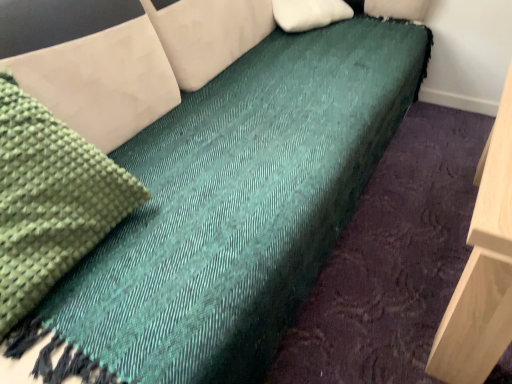
Question: Should I look upward or downward to see green knitted fabric at left?

Choices:
 (A) down
 (B) up

Answer: (B)

Question: Would you consider white soft pillow at upper center to be distant from green knitted fabric at left?

Choices:
 (A) no
 (B) yes

Answer: (B)

Question: Does white soft pillow at upper center have a lesser width compared to green knitted fabric at left?

Choices:
 (A) no
 (B) yes

Answer: (A)

Question: From a real-world perspective, does white soft pillow at upper center stand above green knitted fabric at left?

Choices:
 (A) yes
 (B) no

Answer: (B)

Question: Does white soft pillow at upper center appear on the right side of green knitted fabric at left?

Choices:
 (A) no
 (B) yes

Answer: (B)

Question: Considering the relative sizes of white soft pillow at upper center and green knitted fabric at left in the image provided, is white soft pillow at upper center smaller than green knitted fabric at left?

Choices:
 (A) yes
 (B) no

Answer: (A)

Question: Is white soft pillow at upper center in contact with green knitted fabric at left?

Choices:
 (A) yes
 (B) no

Answer: (B)

Question: Is green knitted fabric at left closer to camera compared to white soft pillow at upper center?

Choices:
 (A) no
 (B) yes

Answer: (B)

Question: Is green knitted fabric at left at the left side of white soft pillow at upper center?

Choices:
 (A) yes
 (B) no

Answer: (A)

Question: Does green knitted fabric at left have a greater height compared to white soft pillow at upper center?

Choices:
 (A) no
 (B) yes

Answer: (B)

Question: Is green knitted fabric at left not close to white soft pillow at upper center?

Choices:
 (A) no
 (B) yes

Answer: (B)

Question: Does green knitted fabric at left appear on the right side of white soft pillow at upper center?

Choices:
 (A) no
 (B) yes

Answer: (A)

Question: From the image's perspective, would you say green knitted fabric at left is positioned over white soft pillow at upper center?

Choices:
 (A) no
 (B) yes

Answer: (A)

Question: Considering their positions, is green knitted fabric at left located in front of or behind white soft pillow at upper center?

Choices:
 (A) behind
 (B) front

Answer: (B)